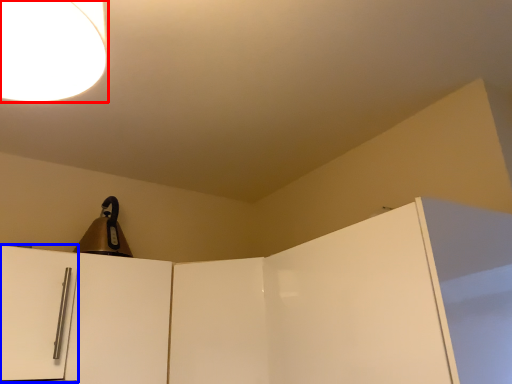
Question: Which point is closer to the camera, lamp (highlighted by a red box) or door (highlighted by a blue box)?

Choices:
 (A) lamp
 (B) door

Answer: (A)